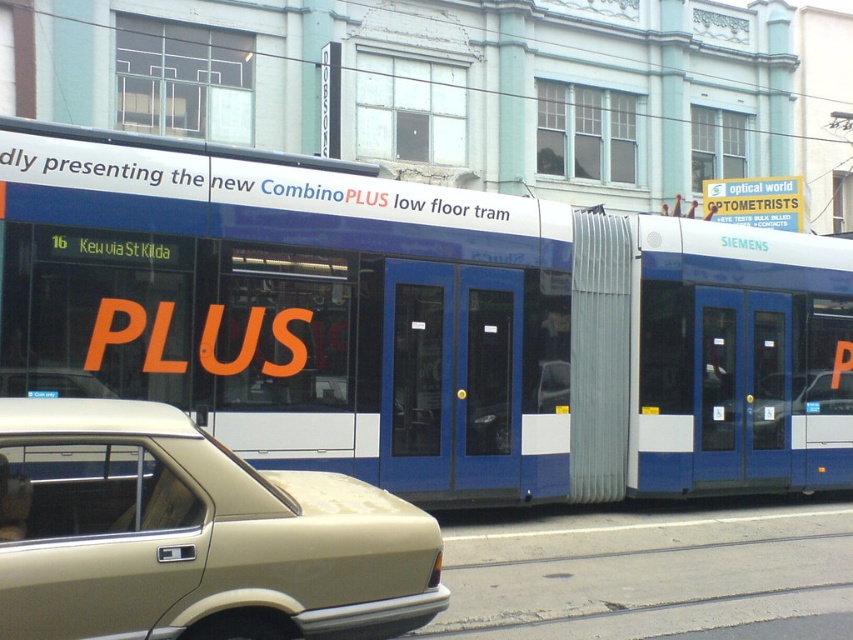
Question: Which object appears farthest from the camera in this image?

Choices:
 (A) white matte bus at center
 (B) beige matte sedan at lower left

Answer: (A)

Question: Can you confirm if white matte bus at center is positioned above beige matte sedan at lower left?

Choices:
 (A) yes
 (B) no

Answer: (A)

Question: From the image, what is the correct spatial relationship of white matte bus at center in relation to beige matte sedan at lower left?

Choices:
 (A) below
 (B) above

Answer: (B)

Question: Which of the following is the closest to the observer?

Choices:
 (A) white matte bus at center
 (B) beige matte sedan at lower left

Answer: (B)

Question: Which point is farther to the camera?

Choices:
 (A) (488, 342)
 (B) (229, 467)

Answer: (A)

Question: Can you confirm if white matte bus at center is thinner than beige matte sedan at lower left?

Choices:
 (A) yes
 (B) no

Answer: (B)